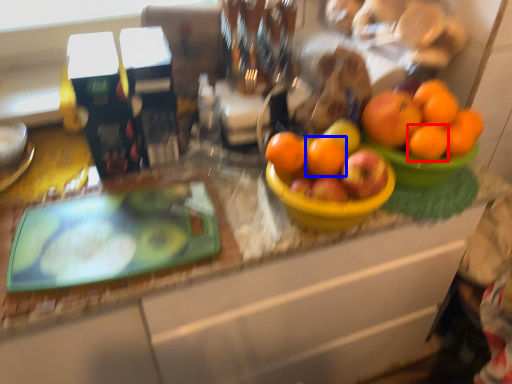
Question: Which point is closer to the camera, orange (highlighted by a red box) or orange (highlighted by a blue box)?

Choices:
 (A) orange
 (B) orange

Answer: (B)